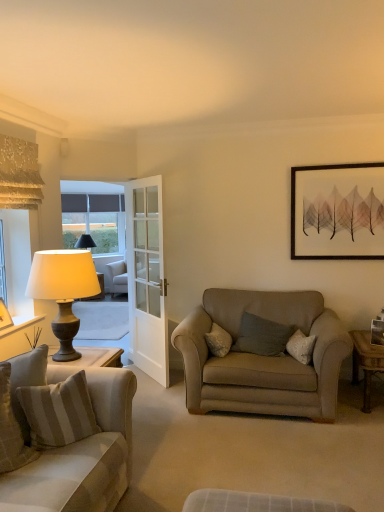
The image size is (384, 512). Identify the location of vacant space situated above matte black picture frame at upper right, placed as the first picture frame when sorted from back to front (from a real-world perspective). 337,165.